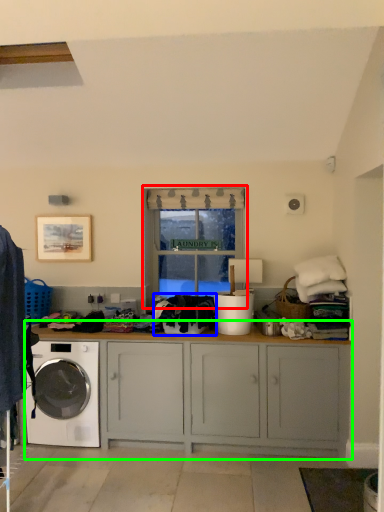
Question: Which object is the closest to the window (highlighted by a red box)? Choose among these: clothing (highlighted by a blue box) or cabinetry (highlighted by a green box).

Choices:
 (A) clothing
 (B) cabinetry

Answer: (A)